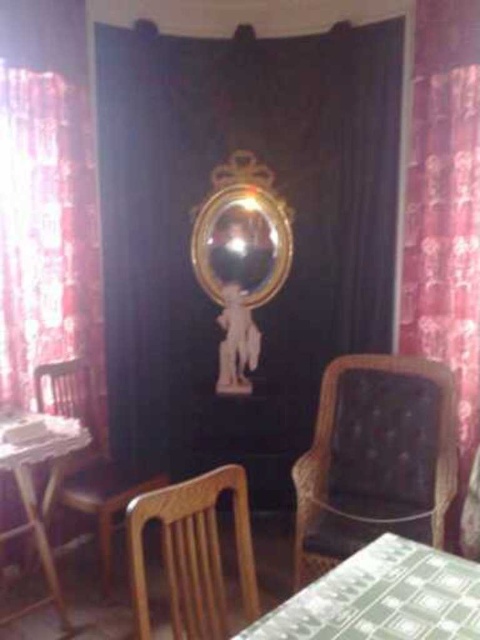
You are standing in the room and see a point marked at coordinates (47,234). According to the scene description, which object is this point located on?

The point is located on the red floral curtain at left.

You are arranging flowers in the dining area and need to place a vase between the red floral curtain at left and the wooden chair at center. According to the scene, where should the vase be placed to ensure it is between both objects?

The vase should be placed between the red floral curtain at left and the wooden chair at center, as the red floral curtain at left is positioned on the left side of wooden chair at center, meaning the space between them is to the right of the curtain and to the left of the chair.

You are a delivery person carrying a package that is 1.2 meters wide. You need to move through the space between the brown textured armchair at center and the wooden chair at left. Can you pass through this space without tilting the package?

The distance between the brown textured armchair at center and the wooden chair at left is 1.15 meters, which is narrower than the 1.2 meters width of the package. Therefore, you cannot pass through without tilting the package.